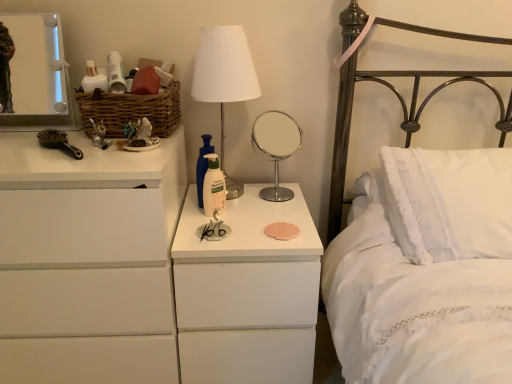
Question: Is white glossy nightstand at center taller or shorter than white fabric lampshade at center?

Choices:
 (A) short
 (B) tall

Answer: (B)

Question: Is white glossy nightstand at center in front of or behind white fabric lampshade at center in the image?

Choices:
 (A) behind
 (B) front

Answer: (B)

Question: Based on their relative distances, which object is farther from the white fabric lampshade at center?

Choices:
 (A) metallic silver toy at left, the first toy in the left-to-right sequence
 (B) woven brown basket at upper left
 (C) white lace pillow at right
 (D) metallic rectangular mirror at upper left, which is the 2th mirror in bottom-to-top order
 (E) chrome/metallic round mirror at center, which is counted as the 2th mirror, starting from the top

Answer: (E)

Question: Which object is the farthest from the white matte chest of drawers at left?

Choices:
 (A) woven brown basket at upper left
 (B) white glossy nightstand at center
 (C) metallic silver toy at left, the first toy in the left-to-right sequence
 (D) chrome/metallic round mirror at center, the 1th mirror positioned from the bottom
 (E) black plastic brush at left

Answer: (D)